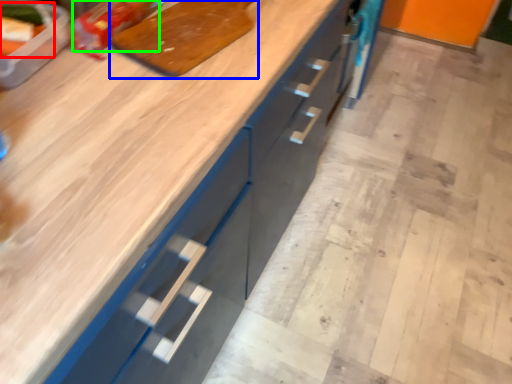
Question: Based on their relative distances, which object is nearer to food (highlighted by a red box)? Choose from cutting board (highlighted by a blue box) and food (highlighted by a green box).

Choices:
 (A) cutting board
 (B) food

Answer: (B)